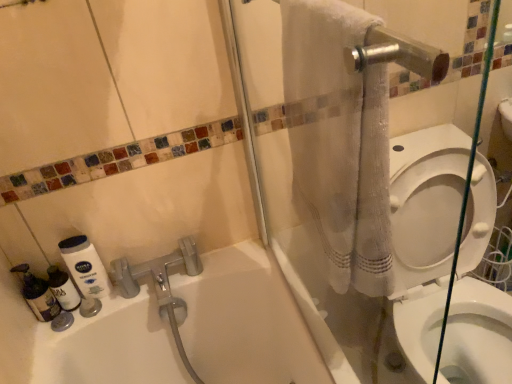
I want to click on white matte lotion at lower left, which is the first cleaning product from right to left, so click(x=85, y=266).

At what (x,y) coordinates should I click in order to perform the action: click on white textured towel at upper right. Please return your answer as a coordinate pair (x, y). The height and width of the screenshot is (384, 512). Looking at the image, I should click on (341, 142).

The height and width of the screenshot is (384, 512). I want to click on translucent plastic bottle at lower left, acting as the second cleaning product starting from the left, so click(x=63, y=288).

Where is `white matte lotion at lower left, which is the first cleaning product from right to left`? white matte lotion at lower left, which is the first cleaning product from right to left is located at coordinates (85, 266).

Could you tell me if white matte lotion at lower left, which ranks as the 3th cleaning product in left-to-right order, is facing translucent plastic bottles at lower left, the first cleaning product viewed from the left?

No, white matte lotion at lower left, which ranks as the 3th cleaning product in left-to-right order, does not turn towards translucent plastic bottles at lower left, the first cleaning product viewed from the left.

Is white matte lotion at lower left, which is the first cleaning product from right to left, located outside translucent plastic bottles at lower left, marked as the 3th cleaning product in a right-to-left arrangement?

white matte lotion at lower left, which is the first cleaning product from right to left, is positioned outside translucent plastic bottles at lower left, marked as the 3th cleaning product in a right-to-left arrangement.

This screenshot has width=512, height=384. I want to click on the 2nd cleaning product to the right when counting from the translucent plastic bottles at lower left, marked as the 3th cleaning product in a right-to-left arrangement, so click(85, 266).

Is white matte lotion at lower left, which is the first cleaning product from right to left, placed right next to translucent plastic bottles at lower left, marked as the 3th cleaning product in a right-to-left arrangement?

They are not placed beside each other.

Could you tell me if white textured towel at upper right is turned towards translucent plastic bottle at lower left, the second cleaning product when ordered from right to left?

No, white textured towel at upper right is not aimed at translucent plastic bottle at lower left, the second cleaning product when ordered from right to left.

Considering the relative positions of white textured towel at upper right and translucent plastic bottle at lower left, acting as the second cleaning product starting from the left, in the image provided, is white textured towel at upper right to the left of translucent plastic bottle at lower left, acting as the second cleaning product starting from the left, from the viewer's perspective?

In fact, white textured towel at upper right is to the right of translucent plastic bottle at lower left, acting as the second cleaning product starting from the left.

Consider the image. Can you confirm if white textured towel at upper right is taller than translucent plastic bottle at lower left, acting as the second cleaning product starting from the left?

Yes.

Consider the image. From a real-world perspective, is white textured towel at upper right over translucent plastic bottle at lower left, acting as the second cleaning product starting from the left?

Yes, from a real-world perspective, white textured towel at upper right is on top of translucent plastic bottle at lower left, acting as the second cleaning product starting from the left.

From the picture: Is white matte lotion at lower left, which ranks as the 3th cleaning product in left-to-right order, aimed at white textured towel at upper right?

No, white matte lotion at lower left, which ranks as the 3th cleaning product in left-to-right order, is not aimed at white textured towel at upper right.

Is the surface of white matte lotion at lower left, which is the first cleaning product from right to left, in direct contact with white textured towel at upper right?

white matte lotion at lower left, which is the first cleaning product from right to left, and white textured towel at upper right are clearly separated.

Is white matte lotion at lower left, which ranks as the 3th cleaning product in left-to-right order, situated inside white textured towel at upper right or outside?

white matte lotion at lower left, which ranks as the 3th cleaning product in left-to-right order, lies outside white textured towel at upper right.

In terms of height, does white matte lotion at lower left, which ranks as the 3th cleaning product in left-to-right order, look taller or shorter compared to white textured towel at upper right?

In the image, white matte lotion at lower left, which ranks as the 3th cleaning product in left-to-right order, appears to be shorter than white textured towel at upper right.

Is translucent plastic bottle at lower left, acting as the second cleaning product starting from the left, looking in the opposite direction of white glossy toilet at right?

No, translucent plastic bottle at lower left, acting as the second cleaning product starting from the left, is not facing the opposite direction of white glossy toilet at right.

In the scene shown: Between translucent plastic bottle at lower left, the second cleaning product when ordered from right to left, and white glossy toilet at right, which one has larger width?

With larger width is white glossy toilet at right.

How many degrees apart are the facing directions of translucent plastic bottle at lower left, the second cleaning product when ordered from right to left, and white glossy toilet at right?

The facing directions of translucent plastic bottle at lower left, the second cleaning product when ordered from right to left, and white glossy toilet at right are 0.707 degrees apart.

Is translucent plastic bottle at lower left, acting as the second cleaning product starting from the left, bigger or smaller than white glossy toilet at right?

Considering their sizes, translucent plastic bottle at lower left, acting as the second cleaning product starting from the left, takes up less space than white glossy toilet at right.

Is white textured towel at upper right positioned behind white matte lotion at lower left, which ranks as the 3th cleaning product in left-to-right order?

No, white textured towel at upper right is closer to the camera.

Considering the sizes of objects white textured towel at upper right and white matte lotion at lower left, which ranks as the 3th cleaning product in left-to-right order, in the image provided, who is smaller, white textured towel at upper right or white matte lotion at lower left, which ranks as the 3th cleaning product in left-to-right order,?

Smaller between the two is white matte lotion at lower left, which ranks as the 3th cleaning product in left-to-right order.

Which of these two, white textured towel at upper right or white matte lotion at lower left, which ranks as the 3th cleaning product in left-to-right order, is thinner?

With smaller width is white matte lotion at lower left, which ranks as the 3th cleaning product in left-to-right order.

From the image's perspective, is white textured towel at upper right above white matte lotion at lower left, which ranks as the 3th cleaning product in left-to-right order?

Yes, from the image's perspective, white textured towel at upper right is above white matte lotion at lower left, which ranks as the 3th cleaning product in left-to-right order.

Can you confirm if translucent plastic bottle at lower left, acting as the second cleaning product starting from the left, is taller than translucent plastic bottles at lower left, the first cleaning product viewed from the left?

In fact, translucent plastic bottle at lower left, acting as the second cleaning product starting from the left, may be shorter than translucent plastic bottles at lower left, the first cleaning product viewed from the left.

From the image's perspective, which object appears higher, translucent plastic bottle at lower left, acting as the second cleaning product starting from the left, or translucent plastic bottles at lower left, marked as the 3th cleaning product in a right-to-left arrangement?

From the image's view, translucent plastic bottle at lower left, acting as the second cleaning product starting from the left, is above.

In the scene shown: Which point is more distant from viewer, (73, 289) or (57, 301)?

The point (73, 289) is more distant.

Between translucent plastic bottle at lower left, the second cleaning product when ordered from right to left, and translucent plastic bottles at lower left, marked as the 3th cleaning product in a right-to-left arrangement, which one appears on the left side from the viewer's perspective?

translucent plastic bottles at lower left, marked as the 3th cleaning product in a right-to-left arrangement.

Considering the points (306, 62) and (50, 298), which point is behind, point (306, 62) or point (50, 298)?

The point (50, 298) is more distant.

Is white textured towel at upper right positioned with its back to translucent plastic bottles at lower left, marked as the 3th cleaning product in a right-to-left arrangement?

No.

From a real-world perspective, which object rests below the other?

translucent plastic bottles at lower left, marked as the 3th cleaning product in a right-to-left arrangement, is physically lower.

From the image's perspective, which cleaning product is the 2nd one below the white matte lotion at lower left, which is the first cleaning product from right to left? Please provide its 2D coordinates.

[(37, 294)]

You are a GUI agent. You are given a task and a screenshot of the screen. Output one action in this format:
    pyautogui.click(x=<x>, y=<y>)
    Task: Click on the 3rd cleaning product behind the white textured towel at upper right
    
    Given the screenshot: What is the action you would take?
    pyautogui.click(x=63, y=288)

Considering their positions, is translucent plastic bottle at lower left, acting as the second cleaning product starting from the left, positioned further to white matte lotion at lower left, which is the first cleaning product from right to left, than white glossy toilet at right?

The object further to white matte lotion at lower left, which is the first cleaning product from right to left, is white glossy toilet at right.

Based on their spatial positions, is translucent plastic bottles at lower left, marked as the 3th cleaning product in a right-to-left arrangement, or white glossy toilet at right closer to white matte lotion at lower left, which ranks as the 3th cleaning product in left-to-right order?

The object closer to white matte lotion at lower left, which ranks as the 3th cleaning product in left-to-right order, is translucent plastic bottles at lower left, marked as the 3th cleaning product in a right-to-left arrangement.

From the image, which object appears to be farther from white textured towel at upper right, translucent plastic bottles at lower left, the first cleaning product viewed from the left, or translucent plastic bottle at lower left, the second cleaning product when ordered from right to left?

translucent plastic bottles at lower left, the first cleaning product viewed from the left, lies further to white textured towel at upper right than the other object.

Based on the photo, based on their spatial positions, is white matte lotion at lower left, which ranks as the 3th cleaning product in left-to-right order, or white textured towel at upper right closer to white glossy toilet at right?

Based on the image, white textured towel at upper right appears to be nearer to white glossy toilet at right.

From the image, which object appears to be farther from translucent plastic bottle at lower left, the second cleaning product when ordered from right to left, white textured towel at upper right or translucent plastic bottles at lower left, the first cleaning product viewed from the left?

The object further to translucent plastic bottle at lower left, the second cleaning product when ordered from right to left, is white textured towel at upper right.

From the image, which object appears to be nearer to white textured towel at upper right, white matte lotion at lower left, which ranks as the 3th cleaning product in left-to-right order, or white glossy toilet at right?

white glossy toilet at right lies closer to white textured towel at upper right than the other object.

Based on their spatial positions, is white matte lotion at lower left, which ranks as the 3th cleaning product in left-to-right order, or white textured towel at upper right closer to translucent plastic bottles at lower left, the first cleaning product viewed from the left?

white matte lotion at lower left, which ranks as the 3th cleaning product in left-to-right order, lies closer to translucent plastic bottles at lower left, the first cleaning product viewed from the left, than the other object.

When comparing their distances from translucent plastic bottles at lower left, marked as the 3th cleaning product in a right-to-left arrangement, does white matte lotion at lower left, which is the first cleaning product from right to left, or white glossy toilet at right seem further?

white glossy toilet at right.

At what (x,y) coordinates should I click in order to perform the action: click on cleaning product between translucent plastic bottle at lower left, the second cleaning product when ordered from right to left, and white glossy toilet at right from left to right. Please return your answer as a coordinate pair (x, y). Looking at the image, I should click on (85, 266).

The image size is (512, 384). Find the location of `cleaning product between translucent plastic bottles at lower left, the first cleaning product viewed from the left, and white matte lotion at lower left, which ranks as the 3th cleaning product in left-to-right order, in the horizontal direction`. cleaning product between translucent plastic bottles at lower left, the first cleaning product viewed from the left, and white matte lotion at lower left, which ranks as the 3th cleaning product in left-to-right order, in the horizontal direction is located at coordinates (63, 288).

The height and width of the screenshot is (384, 512). I want to click on bath towel located between white matte lotion at lower left, which ranks as the 3th cleaning product in left-to-right order, and white glossy toilet at right in the left-right direction, so click(x=341, y=142).

You are a GUI agent. You are given a task and a screenshot of the screen. Output one action in this format:
    pyautogui.click(x=<x>, y=<y>)
    Task: Click on the bath towel between translucent plastic bottles at lower left, the first cleaning product viewed from the left, and white glossy toilet at right, in the horizontal direction
    The image size is (512, 384).
    Given the screenshot: What is the action you would take?
    pyautogui.click(x=341, y=142)